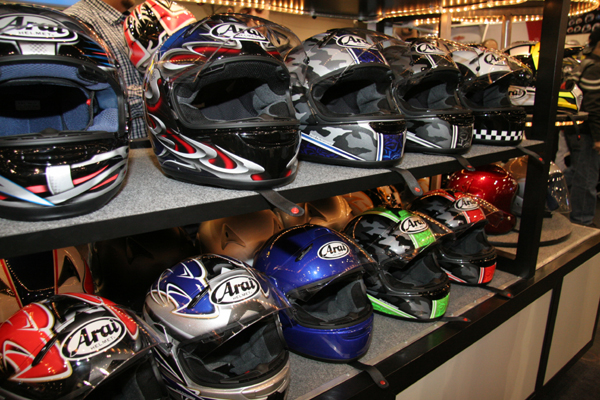
Find the location of `top shelf`. top shelf is located at coordinates (158, 192).